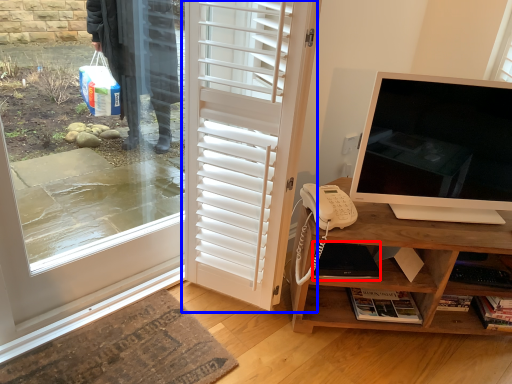
Question: Among these objects, which one is nearest to the camera, laptop (highlighted by a red box) or door (highlighted by a blue box)?

Choices:
 (A) laptop
 (B) door

Answer: (B)